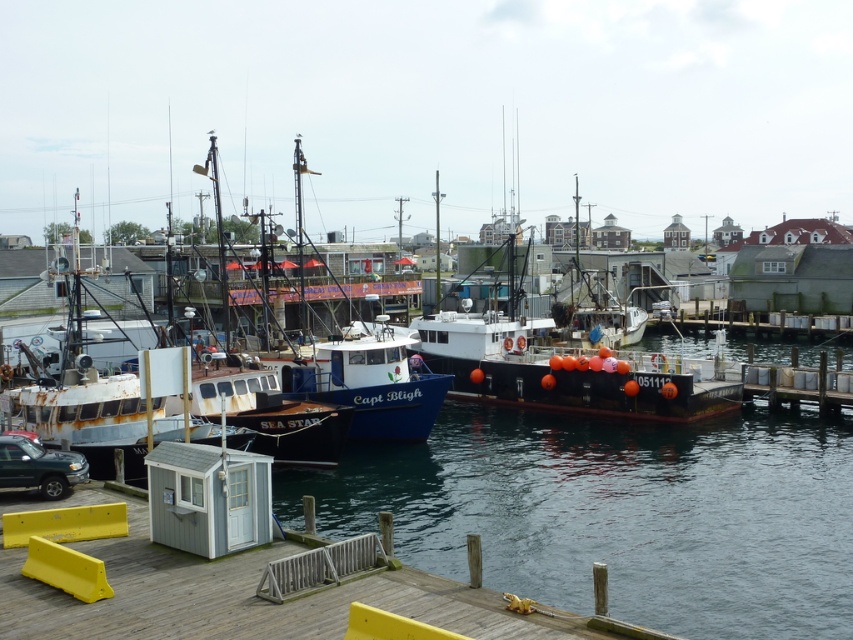
Is wooden dock at lower left positioned behind black matte boat at center?

That is False.

Does wooden dock at lower left have a larger size compared to black matte boat at center?

Incorrect, wooden dock at lower left is not larger than black matte boat at center.

Identify the location of wooden dock at lower left. The image size is (853, 640). (250, 593).

Is point (532, 330) behind point (19, 438)?

Yes, it is.

Is point (587, 333) positioned before point (25, 470)?

That is False.

Identify the location of black matte boat at center. Image resolution: width=853 pixels, height=640 pixels. (570, 365).

Is point (373, 602) positioned before point (33, 472)?

Yes, point (373, 602) is in front of point (33, 472).

Locate an element on the screen. The image size is (853, 640). wooden dock at lower left is located at coordinates (250, 593).